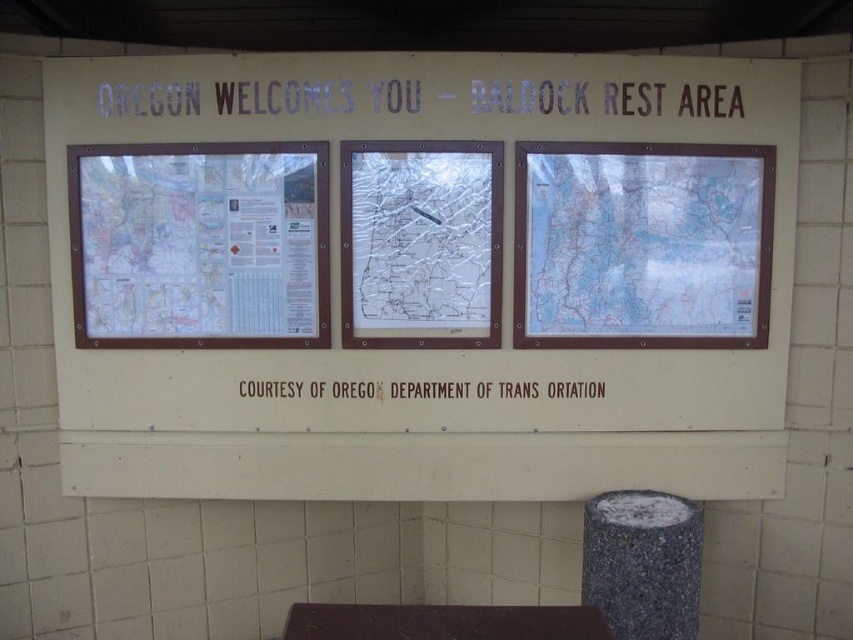
Does white matte signboard at center have a lesser width compared to brown paper text at center?

No.

Can you confirm if white matte signboard at center is wider than brown paper text at center?

Yes.

I want to click on white matte signboard at center, so click(x=425, y=273).

Identify the location of white matte signboard at center. (425, 273).

The height and width of the screenshot is (640, 853). I want to click on matte plastic map at left, so click(x=199, y=244).

Does matte plastic map at left have a lesser width compared to white plastic sign at upper center?

Yes, matte plastic map at left is thinner than white plastic sign at upper center.

Where is `matte plastic map at left`? The height and width of the screenshot is (640, 853). matte plastic map at left is located at coordinates (199, 244).

Is white plastic sign at upper center smaller than granite-like textured pillar at lower right?

Yes, white plastic sign at upper center is smaller than granite-like textured pillar at lower right.

What do you see at coordinates (283, 97) in the screenshot? This screenshot has width=853, height=640. I see `white plastic sign at upper center` at bounding box center [283, 97].

Is point (689, 108) positioned in front of point (669, 564)?

No, (689, 108) is further to viewer.

This screenshot has width=853, height=640. Find the location of `white plastic sign at upper center`. white plastic sign at upper center is located at coordinates (283, 97).